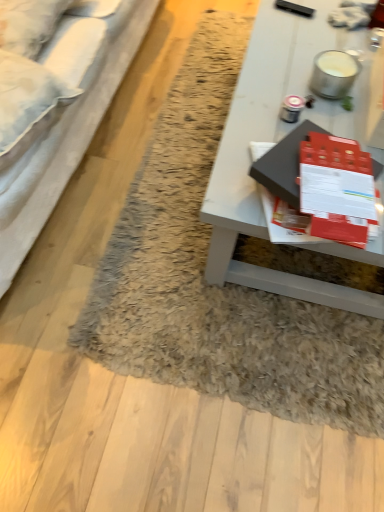
Question: Is fuzzy rug at center bigger than white glossy table at center?

Choices:
 (A) yes
 (B) no

Answer: (B)

Question: Is fuzzy rug at center to the left of white glossy table at center from the viewer's perspective?

Choices:
 (A) yes
 (B) no

Answer: (A)

Question: Is fuzzy rug at center turned away from white glossy table at center?

Choices:
 (A) no
 (B) yes

Answer: (A)

Question: Considering the relative sizes of fuzzy rug at center and white glossy table at center in the image provided, is fuzzy rug at center taller than white glossy table at center?

Choices:
 (A) yes
 (B) no

Answer: (B)

Question: Does fuzzy rug at center touch white glossy table at center?

Choices:
 (A) yes
 (B) no

Answer: (B)

Question: Looking at the image, does matte black book at center seem bigger or smaller compared to white fabric pillow at upper left?

Choices:
 (A) big
 (B) small

Answer: (B)

Question: From their relative heights in the image, would you say matte black book at center is taller or shorter than white fabric pillow at upper left?

Choices:
 (A) tall
 (B) short

Answer: (B)

Question: From the image's perspective, relative to white fabric pillow at upper left, is matte black book at center above or below?

Choices:
 (A) above
 (B) below

Answer: (B)

Question: Considering their positions, is matte black book at center located in front of or behind white fabric pillow at upper left?

Choices:
 (A) front
 (B) behind

Answer: (A)

Question: Based on their sizes in the image, would you say white fabric pillow at upper left is bigger or smaller than matte black book at center?

Choices:
 (A) small
 (B) big

Answer: (B)

Question: Considering their positions, is white fabric pillow at upper left located in front of or behind matte black book at center?

Choices:
 (A) behind
 (B) front

Answer: (A)

Question: Considering the positions of white fabric pillow at upper left and matte black book at center in the image, is white fabric pillow at upper left wider or thinner than matte black book at center?

Choices:
 (A) wide
 (B) thin

Answer: (B)

Question: Which is correct: white fabric pillow at upper left is inside matte black book at center, or outside of it?

Choices:
 (A) inside
 (B) outside

Answer: (B)

Question: Considering their positions, is white fabric studio couch at left located in front of or behind matte black book at center?

Choices:
 (A) front
 (B) behind

Answer: (A)

Question: From the image's perspective, is white fabric studio couch at left positioned above or below matte black book at center?

Choices:
 (A) below
 (B) above

Answer: (B)